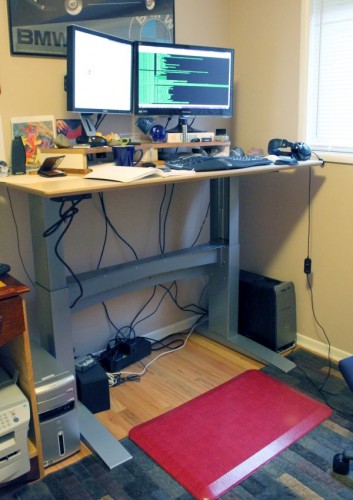
Find the location of `open notebook`. open notebook is located at coordinates (134, 171).